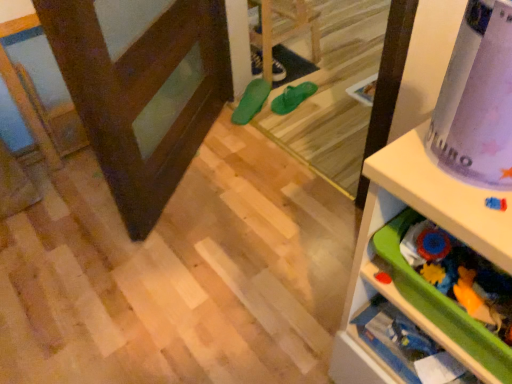
Question: In the image, is purple matte wrapping paper at upper right positioned in front of or behind green rubber flip-flops at center?

Choices:
 (A) front
 (B) behind

Answer: (A)

Question: From a real-world perspective, is purple matte wrapping paper at upper right positioned above or below green rubber flip-flops at center?

Choices:
 (A) below
 (B) above

Answer: (B)

Question: Which object is the farthest from the green rubber shoe at center, the first footwear when ordered from front to back?

Choices:
 (A) white plastic shelf at upper right, which is the 1th shelf from front to back
 (B) green rubber flip-flops at center, the 2th footwear positioned from the back
 (C) dark brown wood screen door at left
 (D) purple matte wrapping paper at upper right
 (E) green rubber flip-flops at center

Answer: (D)

Question: Based on their relative distances, which object is farther from the white plastic shelf at upper right, which is the 1th shelf from front to back?

Choices:
 (A) purple matte wrapping paper at upper right
 (B) green rubber flip-flops at center
 (C) green rubber shoe at center, which appears as the third footwear when viewed from the back
 (D) green rubber flip-flops at center, the 2th footwear positioned from the back
 (E) dark brown wood screen door at left

Answer: (B)